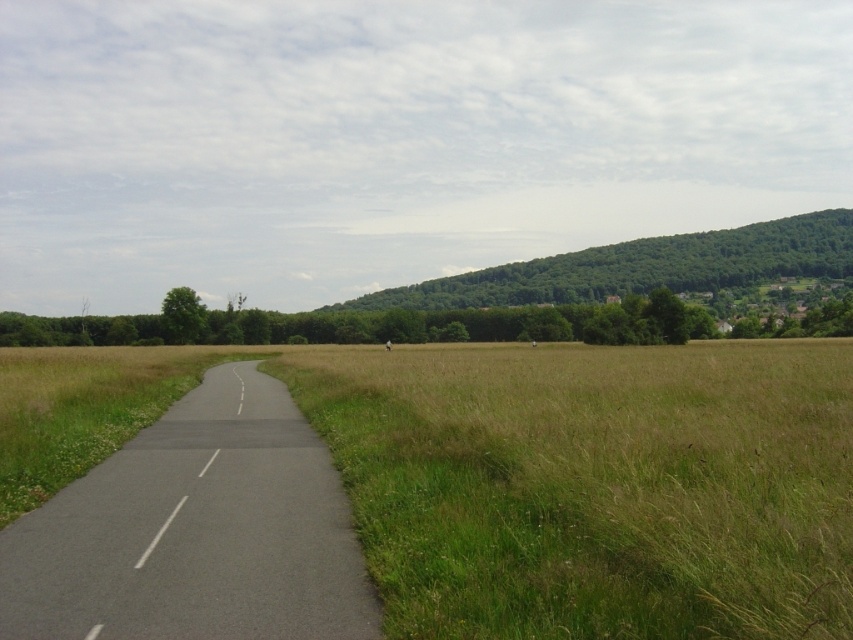
Question: Which object is positioned farthest from the green leafy hill at upper right?

Choices:
 (A) asphalt road at center
 (B) green grass at center

Answer: (A)

Question: Which point appears closest to the camera in this image?

Choices:
 (A) (657, 488)
 (B) (218, 417)
 (C) (534, 260)

Answer: (A)

Question: Is green grass at center to the right of asphalt road at center from the viewer's perspective?

Choices:
 (A) yes
 (B) no

Answer: (A)

Question: Is green grass at center to the left of green leafy hill at upper right from the viewer's perspective?

Choices:
 (A) yes
 (B) no

Answer: (A)

Question: Which point is farther to the camera?

Choices:
 (A) asphalt road at center
 (B) green leafy hill at upper right
 (C) green grass at center

Answer: (B)

Question: Is green grass at center to the left of asphalt road at center from the viewer's perspective?

Choices:
 (A) yes
 (B) no

Answer: (B)